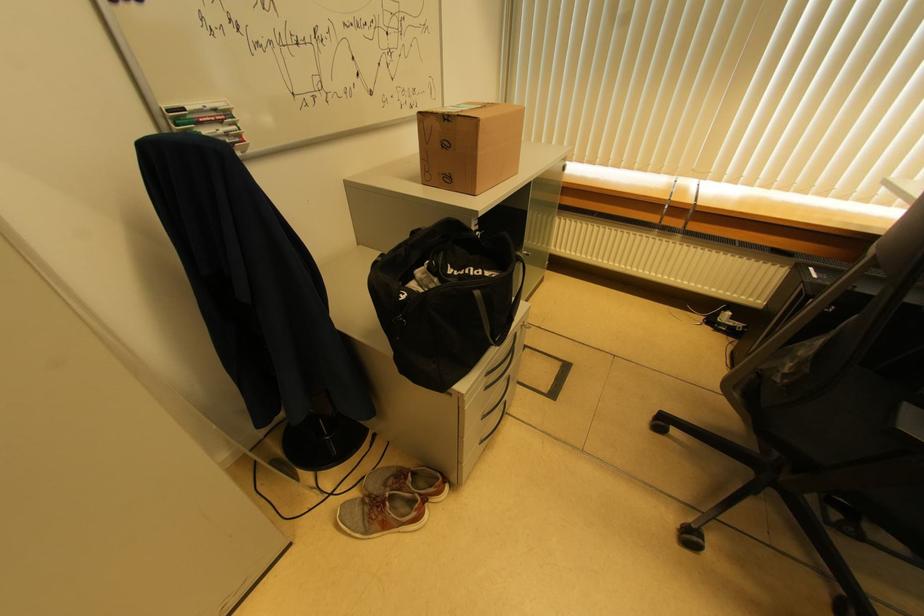
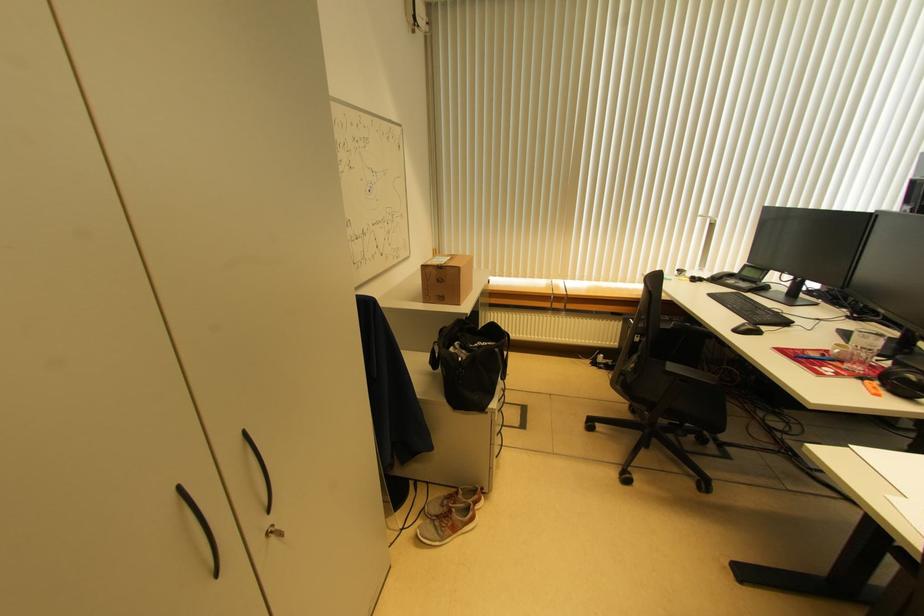
Find the pixel in the second image that matches point 379,529 in the first image.

(450, 535)